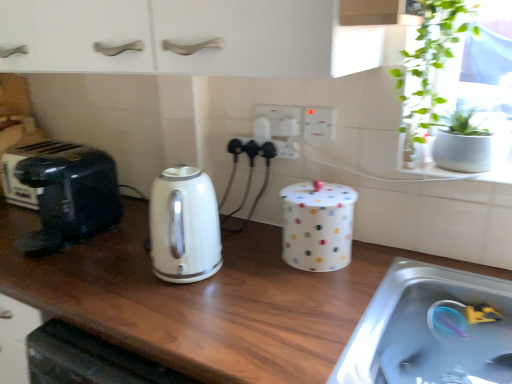
Question: From a real-world perspective, is wooden at center over white glossy electric kettle at center?

Choices:
 (A) no
 (B) yes

Answer: (A)

Question: Is wooden at center to the right of white glossy electric kettle at center from the viewer's perspective?

Choices:
 (A) no
 (B) yes

Answer: (A)

Question: Can you confirm if wooden at center is smaller than white glossy electric kettle at center?

Choices:
 (A) yes
 (B) no

Answer: (B)

Question: Is wooden at center positioned with its back to white glossy electric kettle at center?

Choices:
 (A) no
 (B) yes

Answer: (A)

Question: Is wooden at center taller than white glossy electric kettle at center?

Choices:
 (A) no
 (B) yes

Answer: (B)

Question: Does wooden at center have a larger size compared to white glossy electric kettle at center?

Choices:
 (A) no
 (B) yes

Answer: (B)

Question: Can you confirm if wooden at center is wider than white plastic electrical outlet at center, the 1th electric outlet viewed from the right?

Choices:
 (A) yes
 (B) no

Answer: (A)

Question: Is wooden at center shorter than white plastic electrical outlet at center, the 1th electric outlet viewed from the right?

Choices:
 (A) yes
 (B) no

Answer: (B)

Question: Can you confirm if wooden at center is thinner than white plastic electrical outlet at center, the 1th electric outlet viewed from the right?

Choices:
 (A) yes
 (B) no

Answer: (B)

Question: Is wooden at center at the right side of white plastic electrical outlet at center, the 1th electric outlet viewed from the right?

Choices:
 (A) no
 (B) yes

Answer: (A)

Question: Is wooden at center positioned beyond the bounds of white plastic electrical outlet at center, the third electric outlet positioned from the left?

Choices:
 (A) yes
 (B) no

Answer: (A)

Question: From a real-world perspective, is wooden at center positioned over white plastic electrical outlet at center, the 1th electric outlet viewed from the right, based on gravity?

Choices:
 (A) no
 (B) yes

Answer: (A)

Question: Is white glossy electric kettle at center far away from white polka dot container at center, marked as the second appliance in a back-to-front arrangement?

Choices:
 (A) yes
 (B) no

Answer: (B)